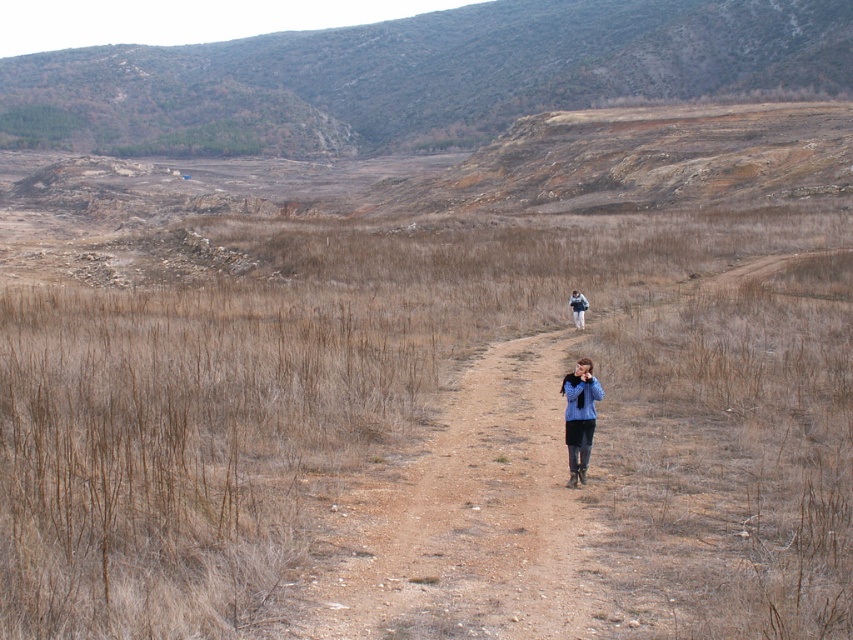
Which of these two, brown dry grass at center or green textured hillside at upper center, stands taller?

green textured hillside at upper center is taller.

Is the position of brown dry grass at center more distant than that of green textured hillside at upper center?

No, it is in front of green textured hillside at upper center.

Between point (288, 413) and point (45, 83), which one is positioned in front?

Point (288, 413) is in front.

Locate an element on the screen. brown dry grass at center is located at coordinates (425, 410).

Does green textured hillside at upper center appear on the left side of blue fabric jacket at center?

Indeed, green textured hillside at upper center is positioned on the left side of blue fabric jacket at center.

Is green textured hillside at upper center wider than blue fabric jacket at center?

Correct, the width of green textured hillside at upper center exceeds that of blue fabric jacket at center.

Image resolution: width=853 pixels, height=640 pixels. Identify the location of green textured hillside at upper center. (419, 76).

Can you confirm if green textured hillside at upper center is smaller than blue denim jacket at center?

No.

Is point (645, 4) in front of point (576, 320)?

No, (645, 4) is further to viewer.

Between point (254, 83) and point (576, 304), which one is positioned behind?

The point (254, 83) is more distant.

This screenshot has width=853, height=640. Identify the location of green textured hillside at upper center. (419, 76).